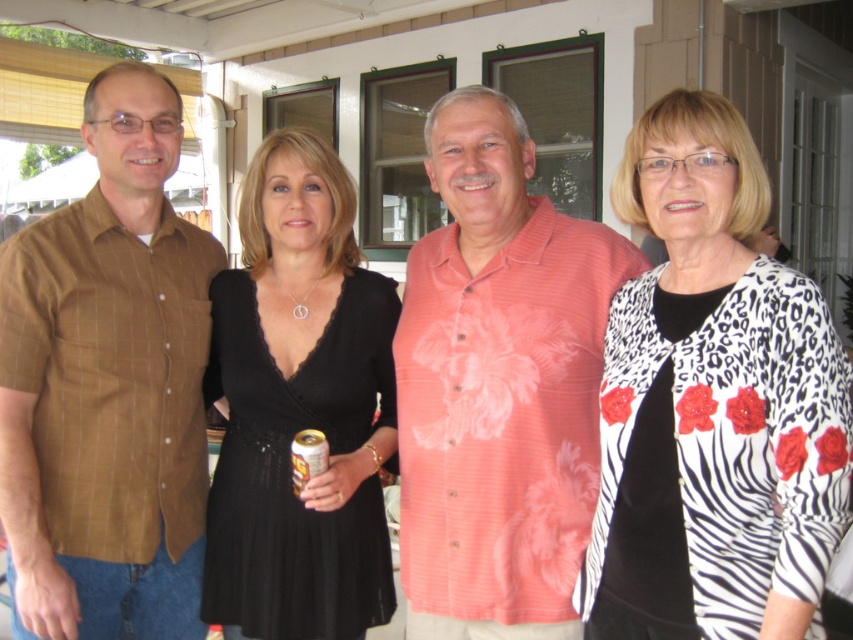
What is located at the point with coordinates (498, 385)?

The pink floral shirt at center is located at the point with coordinates (498, 385).

In the scene shown: You are a photographer taking a picture of the white zebra print cardigan at right and the gold metallic can at center. Which object should you focus on first if you want to capture both in the same frame without moving the camera?

The white zebra print cardigan at right is much taller than the gold metallic can at center, so you should focus on the white zebra print cardigan at right first to ensure it is fully in frame.

What is the color of the object located at point (x=712, y=404)?

The object at point (x=712, y=404) is the white zebra print cardigan at right.